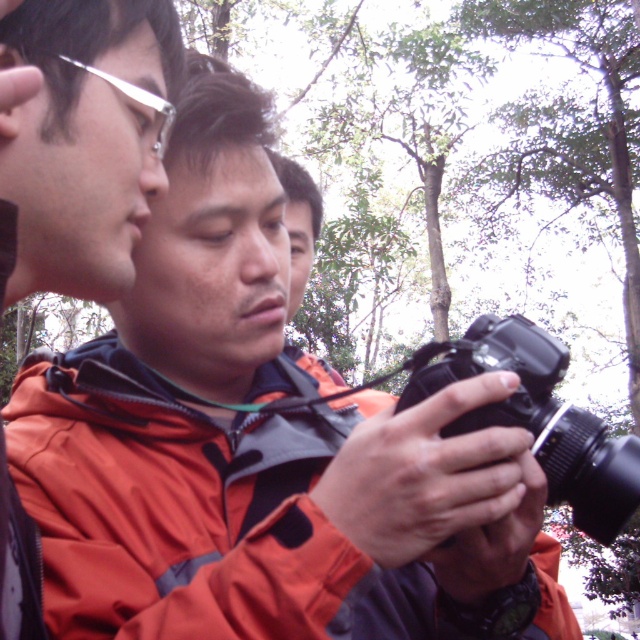
Question: Where is black plastic camera at center located in relation to silver metallic glasses at upper left in the image?

Choices:
 (A) left
 (B) right

Answer: (B)

Question: Which point is farther to the camera?

Choices:
 (A) orange fabric jacket at center
 (B) silver metallic glasses at upper left
 (C) black plastic camera at center

Answer: (C)

Question: Which object is positioned farthest from the matte orange jacket at left?

Choices:
 (A) silver metallic glasses at upper left
 (B) orange fabric jacket at center

Answer: (B)

Question: Can you confirm if black plastic camera at center is thinner than silver metallic glasses at upper left?

Choices:
 (A) yes
 (B) no

Answer: (B)

Question: Is black plastic camera at center wider than silver metallic glasses at upper left?

Choices:
 (A) no
 (B) yes

Answer: (B)

Question: Which object is farther from the camera taking this photo?

Choices:
 (A) silver metallic glasses at upper left
 (B) matte orange jacket at left
 (C) black plastic camera at center

Answer: (C)